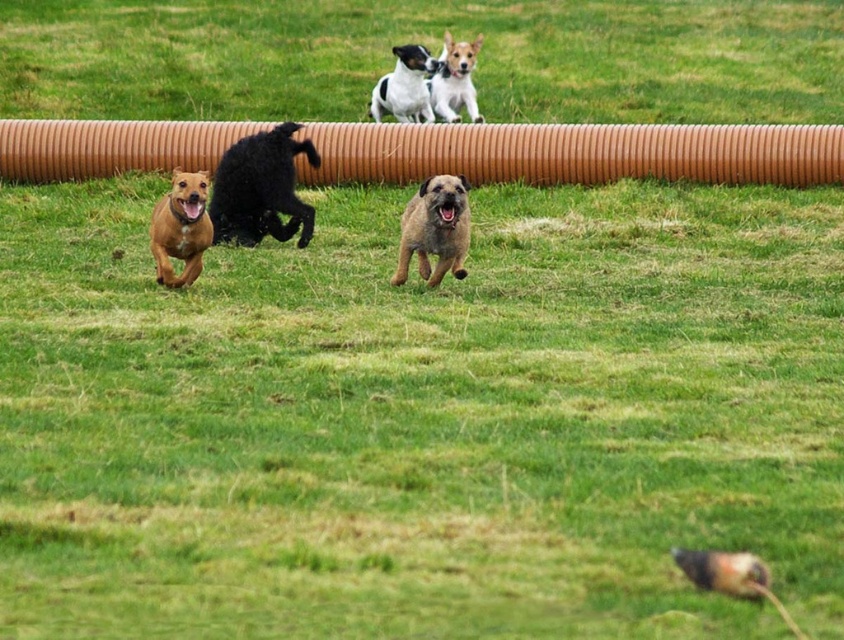
Question: Among these points, which one is farthest from the camera?

Choices:
 (A) (168, 202)
 (B) (404, 54)
 (C) (448, 237)

Answer: (B)

Question: From the image, what is the correct spatial relationship of shiny black dog at left in relation to smooth tan dog at lower left?

Choices:
 (A) left
 (B) right

Answer: (B)

Question: Is shiny black dog at left closer to the viewer compared to smooth tan dog at upper center?

Choices:
 (A) no
 (B) yes

Answer: (B)

Question: Which point is farther to the camera?

Choices:
 (A) smooth tan dog at lower left
 (B) brown shaggy dog at center
 (C) shiny black dog at left
 (D) smooth tan dog at upper center

Answer: (D)

Question: Does smooth tan dog at lower left have a lesser width compared to white and black fur dog at upper center?

Choices:
 (A) yes
 (B) no

Answer: (A)

Question: Which point is closer to the camera?

Choices:
 (A) shiny black dog at left
 (B) smooth tan dog at upper center
 (C) brown shaggy dog at center

Answer: (C)